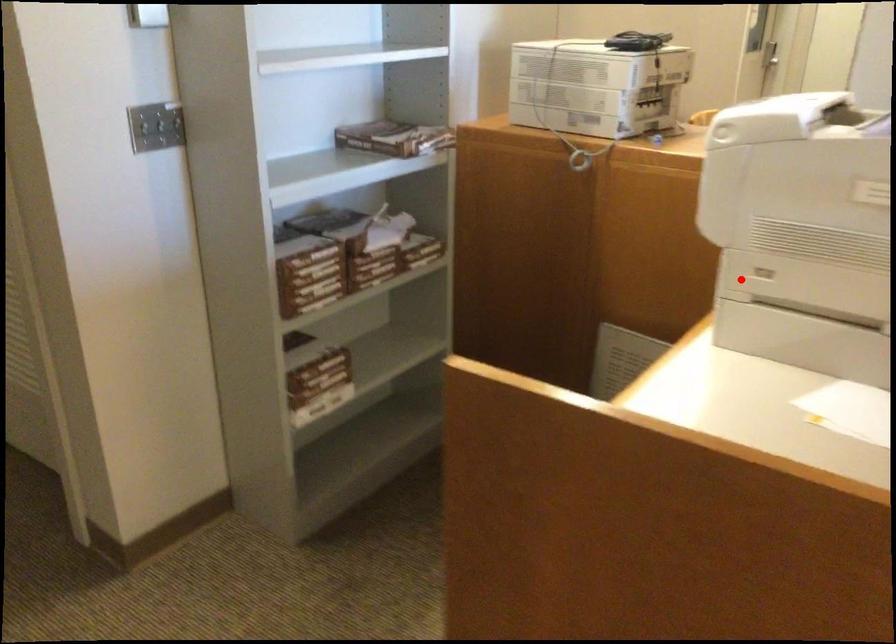
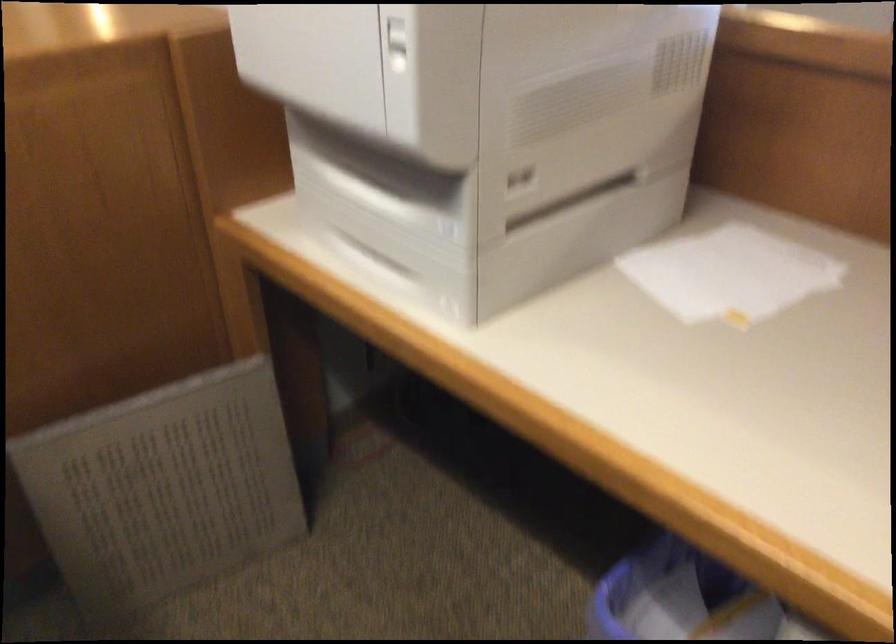
Question: I am providing you with two images of the same scene from different viewpoints. A red point is shown in image1. For the corresponding object point in image2, is it positioned nearer or farther from the camera?

Choices:
 (A) Nearer
 (B) Farther

Answer: (A)